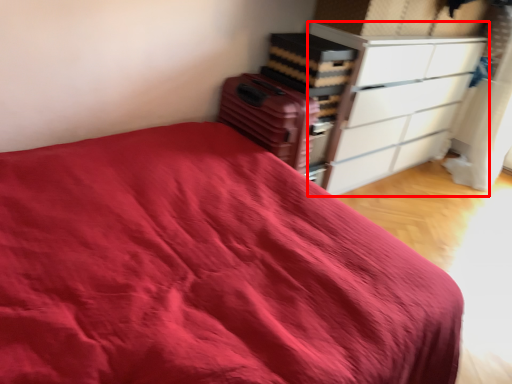
Question: Where is chest of drawers (annotated by the red box) located in relation to luggage in the image?

Choices:
 (A) right
 (B) left

Answer: (A)